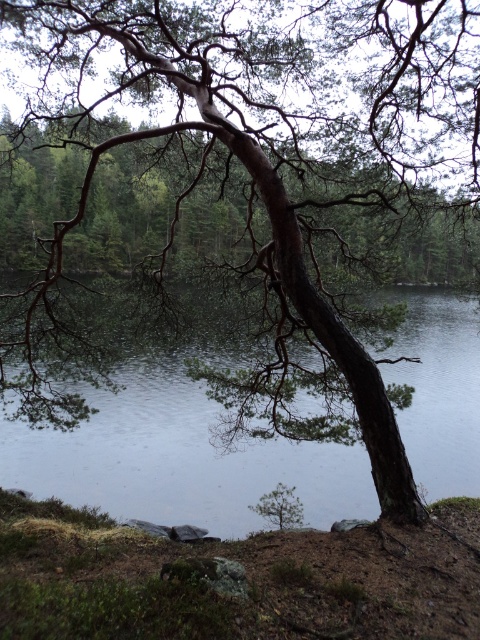
Question: Is brown dirt at lower center to the left of transparent water at center from the viewer's perspective?

Choices:
 (A) no
 (B) yes

Answer: (A)

Question: Can you confirm if brown dirt at lower center is bigger than transparent water at center?

Choices:
 (A) no
 (B) yes

Answer: (B)

Question: Which object is closer to the camera taking this photo?

Choices:
 (A) transparent water at center
 (B) brown dirt at lower center

Answer: (B)

Question: Can you confirm if brown dirt at lower center is bigger than transparent water at center?

Choices:
 (A) no
 (B) yes

Answer: (B)

Question: Which point is closer to the camera taking this photo?

Choices:
 (A) (7, 609)
 (B) (51, 493)

Answer: (A)